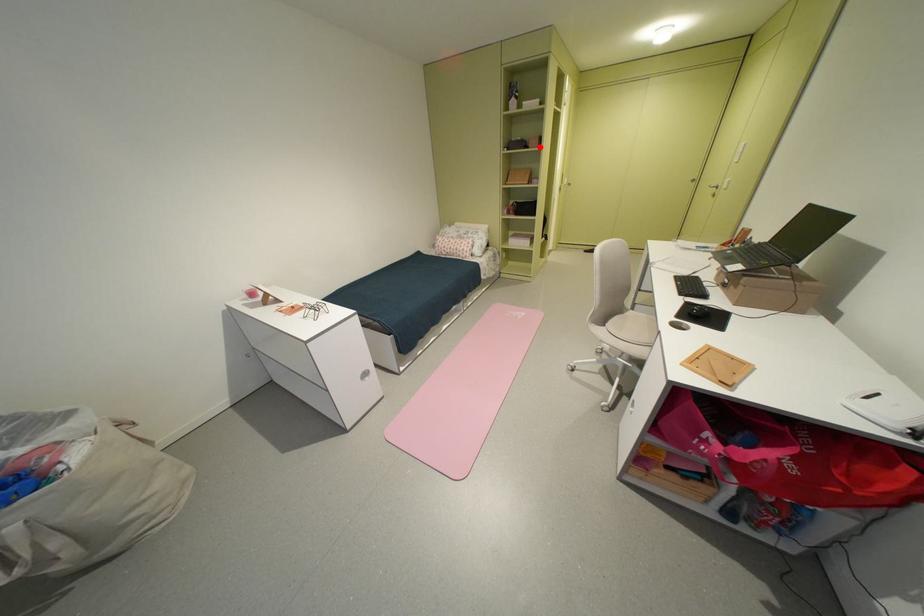
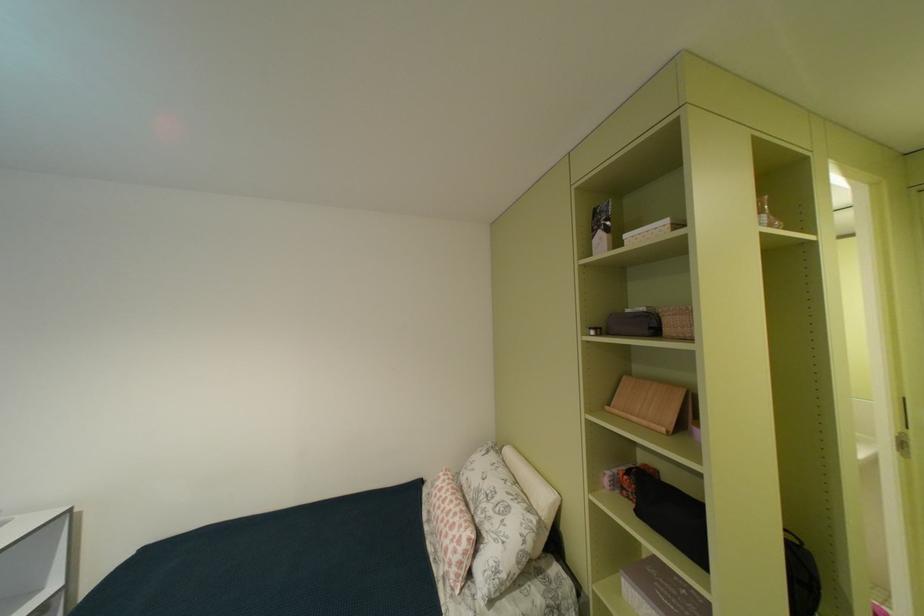
Question: A red point is marked in image1. In image2, is the corresponding 3D point closer to the camera or farther? Reply with the corresponding letter.

Choices:
 (A) The corresponding 3D point is closer.
 (B) The corresponding 3D point is farther.

Answer: (B)